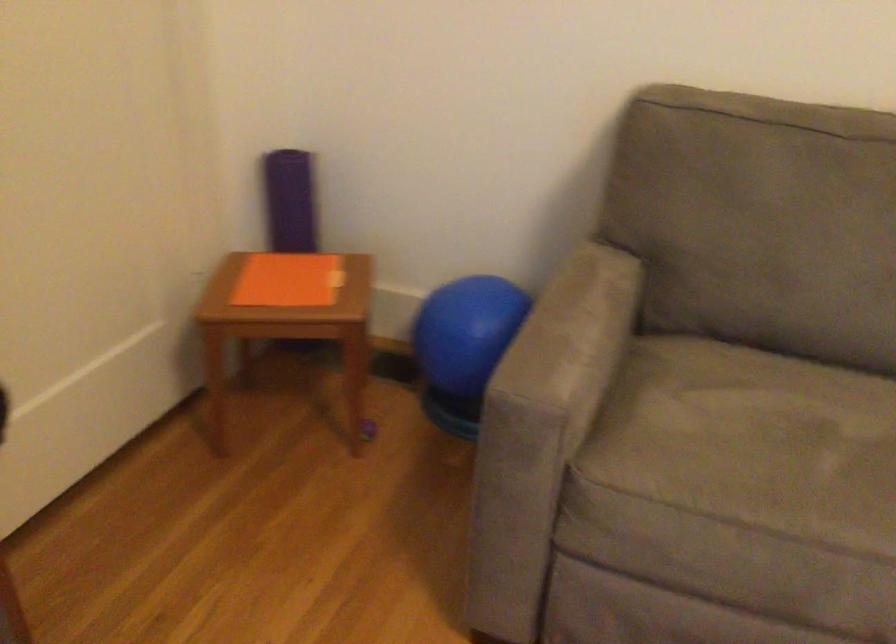
Find the location of `sofa armrest`. sofa armrest is located at coordinates (572, 333).